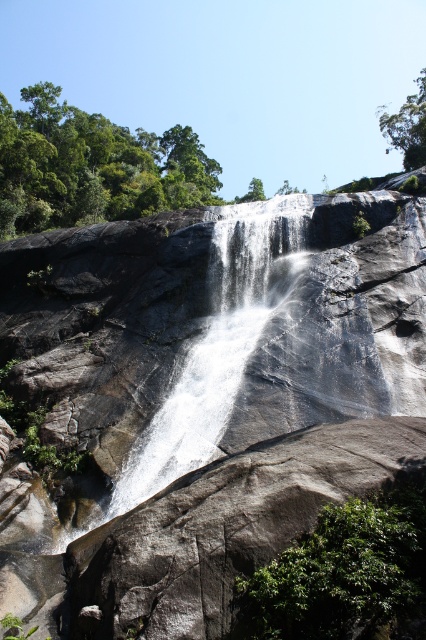
You are a bird looking for a place to perch. You see the green leafy trees at upper left and the green leafy bush at lower right. Which one has a wider spread of branches to sit on?

The green leafy trees at upper left has a larger width than the green leafy bush at lower right, so it has a wider spread of branches to sit on.

Based on the photo, you are a hiker who wants to take a photo of the waterfall. You have a camera with a 50mm lens. The green leafy trees at upper left are blocking your view. Can you move closer to the waterfall to get a better shot without the trees in the frame?

The green leafy trees at upper left are 30.54 meters away from you. With a 50mm lens, you can move closer to the waterfall to reduce the field of view, which might allow you to exclude the trees from the frame if the distance adjustment is sufficient.

You are standing at the base of the waterfall and want to take a photo of the green leafy trees at upper left. Which direction should you face to capture them in your shot?

You should face the upper left direction to capture the green leafy trees at upper left in your shot since they are located at point (92, 166).